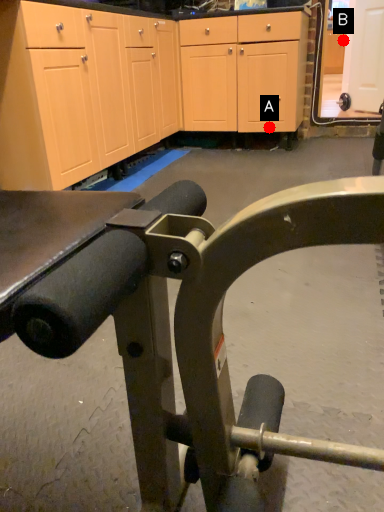
Question: Two points are circled on the image, labeled by A and B beside each circle. Which of the following is the closest to the observer?

Choices:
 (A) A is closer
 (B) B is closer

Answer: (A)